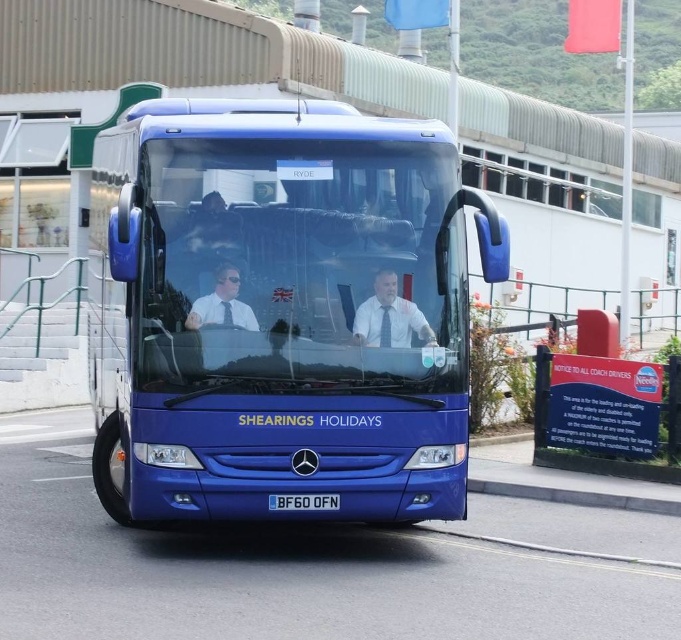
Between matte white shirt at center and blue plastic license plate at center, which one has less height?

blue plastic license plate at center is shorter.

Which is in front, point (402, 324) or point (287, 508)?

Point (287, 508) is in front.

What are the coordinates of `matte white shirt at center` in the screenshot? It's located at (390, 317).

Does blue metallic bus at center have a greater width compared to blue plastic license plate at center?

Yes.

Who is positioned more to the left, blue metallic bus at center or blue plastic license plate at center?

blue metallic bus at center

At what (x,y) coordinates should I click in order to perform the action: click on blue metallic bus at center. Please return your answer as a coordinate pair (x, y). Looking at the image, I should click on (285, 310).

Image resolution: width=681 pixels, height=640 pixels. I want to click on blue metallic bus at center, so click(x=285, y=310).

Which is below, matte white shirt at center or matte blue uniform at center?

matte white shirt at center is below.

The width and height of the screenshot is (681, 640). What do you see at coordinates (390, 317) in the screenshot?
I see `matte white shirt at center` at bounding box center [390, 317].

The image size is (681, 640). Find the location of `matte white shirt at center`. matte white shirt at center is located at coordinates (390, 317).